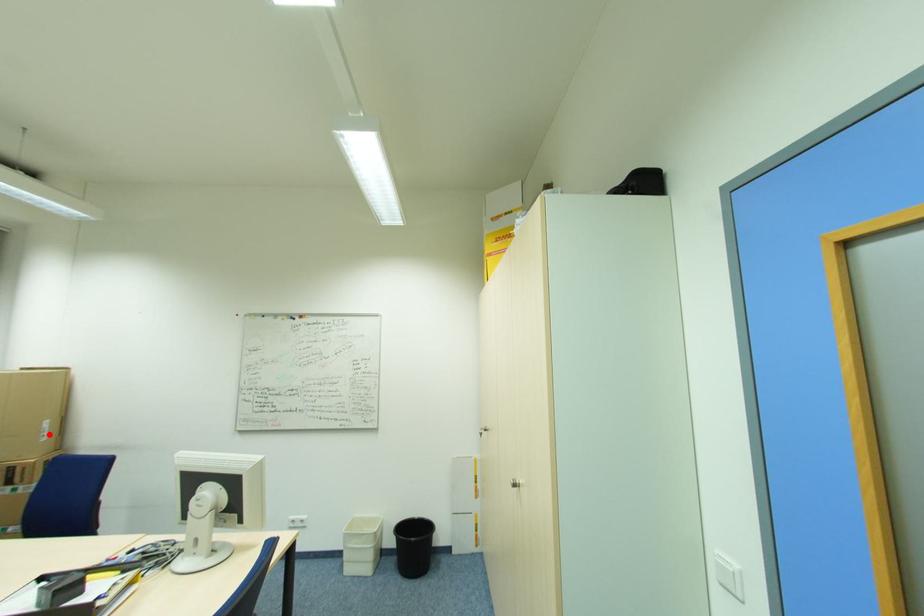
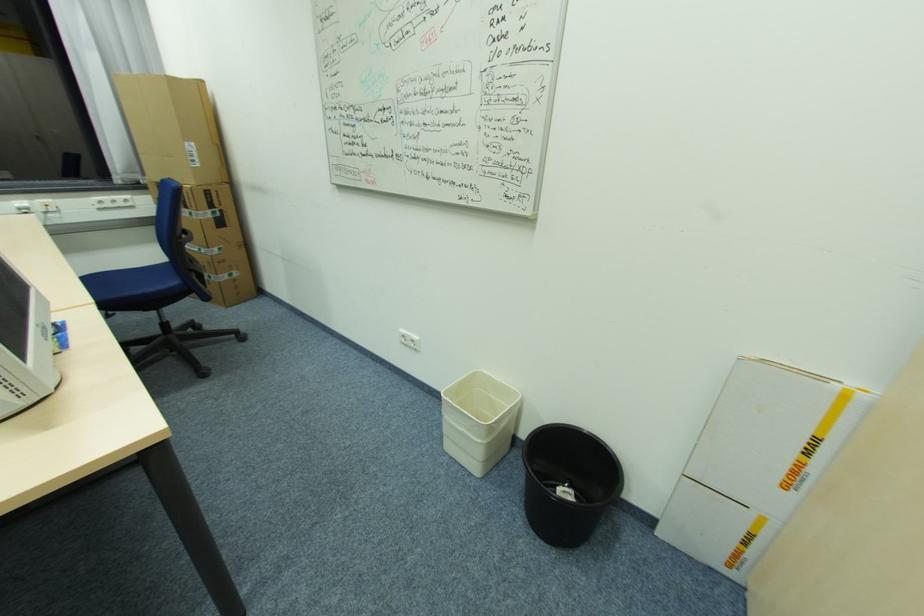
Find the pixel in the second image that matches the highlighted location in the first image.

(200, 161)